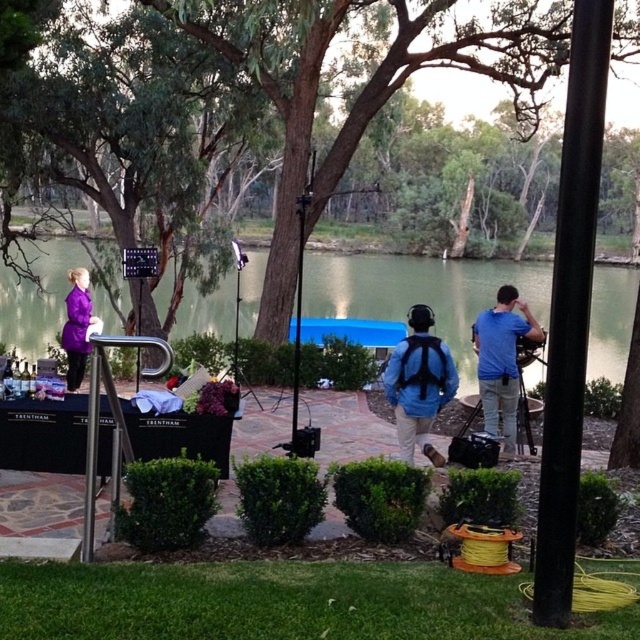
Does green water at center appear over green leafy tree at upper center?

Actually, green water at center is below green leafy tree at upper center.

Measure the distance between green water at center and camera.

A distance of 3.38 meters exists between green water at center and camera.

Locate an element on the screen. This screenshot has width=640, height=640. green water at center is located at coordinates (420, 292).

Is point (483, 266) less distant than point (90, 317)?

No, (483, 266) is further to viewer.

Is green water at center further to camera compared to matte purple coat at left?

No, it is in front of matte purple coat at left.

Is point (380, 269) farther from viewer compared to point (84, 316)?

Yes, point (380, 269) is behind point (84, 316).

The image size is (640, 640). I want to click on green water at center, so click(420, 292).

Is green water at center closer to the viewer compared to blue matte backpack at center?

Yes, green water at center is closer to the viewer.

Between green water at center and blue matte backpack at center, which one has more height?

Standing taller between the two is green water at center.

Who is more forward, (355, 289) or (397, 417)?

Point (397, 417) is more forward.

Identify the location of green water at center. (420, 292).